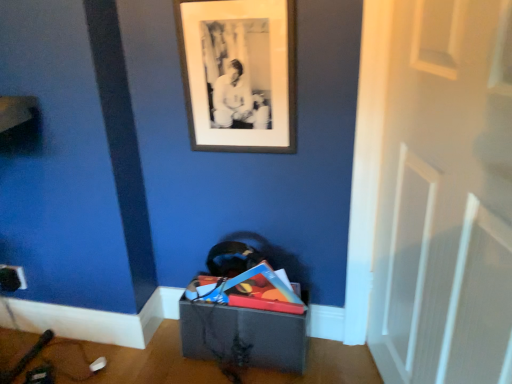
Question: Considering the relative positions of white matte door at center and matte gray storage box at lower center in the image provided, is white matte door at center in front of matte gray storage box at lower center?

Choices:
 (A) yes
 (B) no

Answer: (A)

Question: From a real-world perspective, is white matte door at center under matte gray storage box at lower center?

Choices:
 (A) yes
 (B) no

Answer: (B)

Question: Is white matte door at center turned away from matte gray storage box at lower center?

Choices:
 (A) yes
 (B) no

Answer: (B)

Question: Is white matte door at center behind matte gray storage box at lower center?

Choices:
 (A) yes
 (B) no

Answer: (B)

Question: Can you confirm if white matte door at center is thinner than matte gray storage box at lower center?

Choices:
 (A) yes
 (B) no

Answer: (A)

Question: From their relative heights in the image, would you say white matte door at center is taller or shorter than black matte picture frame at upper center?

Choices:
 (A) tall
 (B) short

Answer: (A)

Question: From the image's perspective, is white matte door at center positioned above or below black matte picture frame at upper center?

Choices:
 (A) below
 (B) above

Answer: (A)

Question: From a real-world perspective, is white matte door at center above or below black matte picture frame at upper center?

Choices:
 (A) above
 (B) below

Answer: (B)

Question: Considering the positions of point (413, 183) and point (247, 59), is point (413, 183) closer or farther from the camera than point (247, 59)?

Choices:
 (A) farther
 (B) closer

Answer: (B)

Question: Do you think matte gray storage box at lower center is within white matte door at center, or outside of it?

Choices:
 (A) inside
 (B) outside

Answer: (B)

Question: From the image's perspective, is matte gray storage box at lower center positioned above or below white matte door at center?

Choices:
 (A) below
 (B) above

Answer: (A)

Question: Looking at their shapes, would you say matte gray storage box at lower center is wider or thinner than white matte door at center?

Choices:
 (A) thin
 (B) wide

Answer: (B)

Question: Does point (263, 355) appear closer or farther from the camera than point (441, 132)?

Choices:
 (A) closer
 (B) farther

Answer: (B)

Question: Is black matte picture frame at upper center in front of or behind matte gray storage box at lower center in the image?

Choices:
 (A) behind
 (B) front

Answer: (B)

Question: From a real-world perspective, is black matte picture frame at upper center physically located above or below matte gray storage box at lower center?

Choices:
 (A) above
 (B) below

Answer: (A)